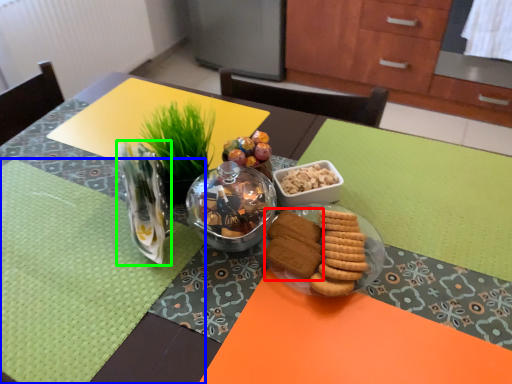
Question: Based on their relative distances, which object is nearer to snack (highlighted by a red box)? Choose from place mat (highlighted by a blue box) and tableware (highlighted by a green box).

Choices:
 (A) place mat
 (B) tableware

Answer: (B)